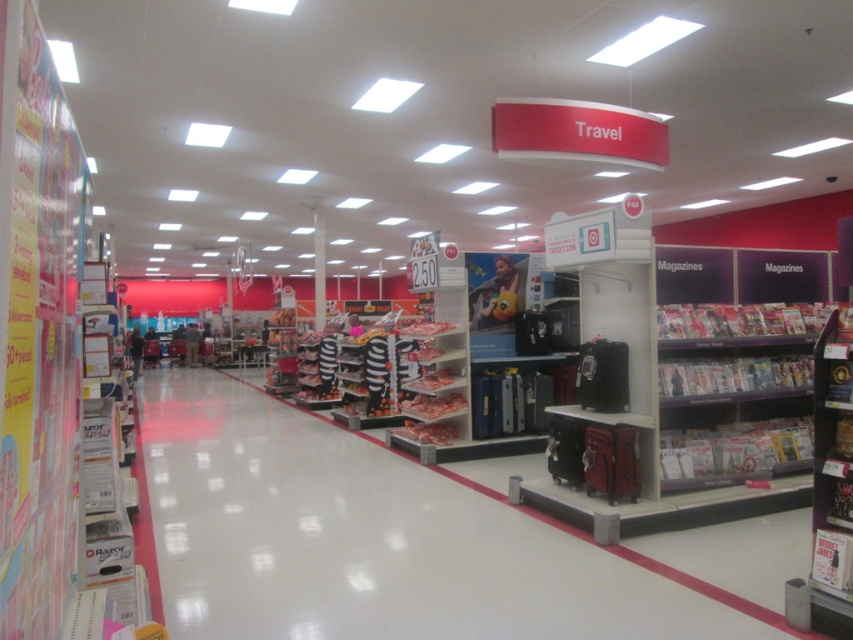
In the scene shown: You are a customer in the travel section of a store. You see a metallic suitcase at center and metallic silver magazines at lower right. Which item is physically nearer to you?

The metallic suitcase at center is closer to the viewer than the metallic silver magazines at lower right.

You are a customer in the travel section of a store. You see a metallic suitcase at center and metallic silver magazines at lower right. Which item is positioned lower in the image?

The metallic suitcase at center is positioned lower than the metallic silver magazines at lower right.